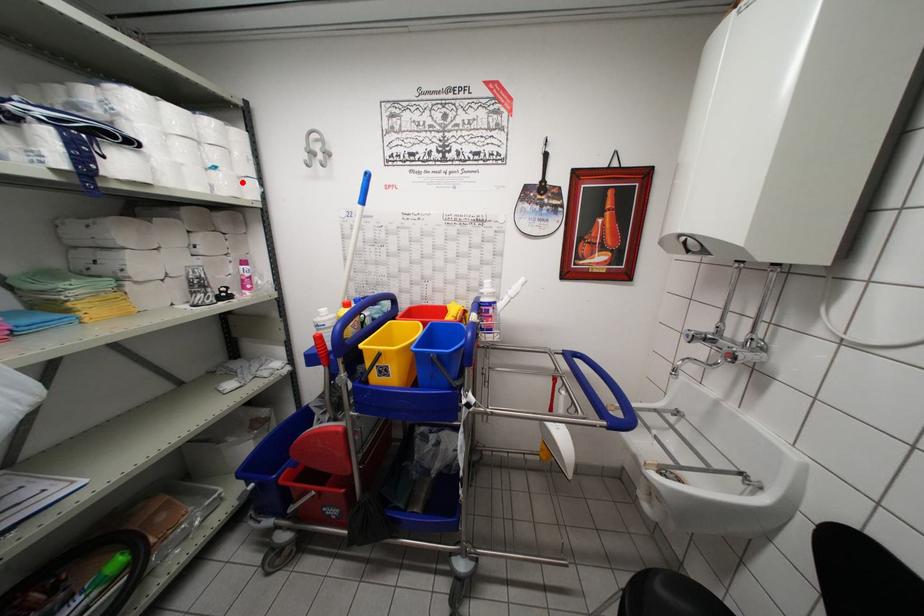
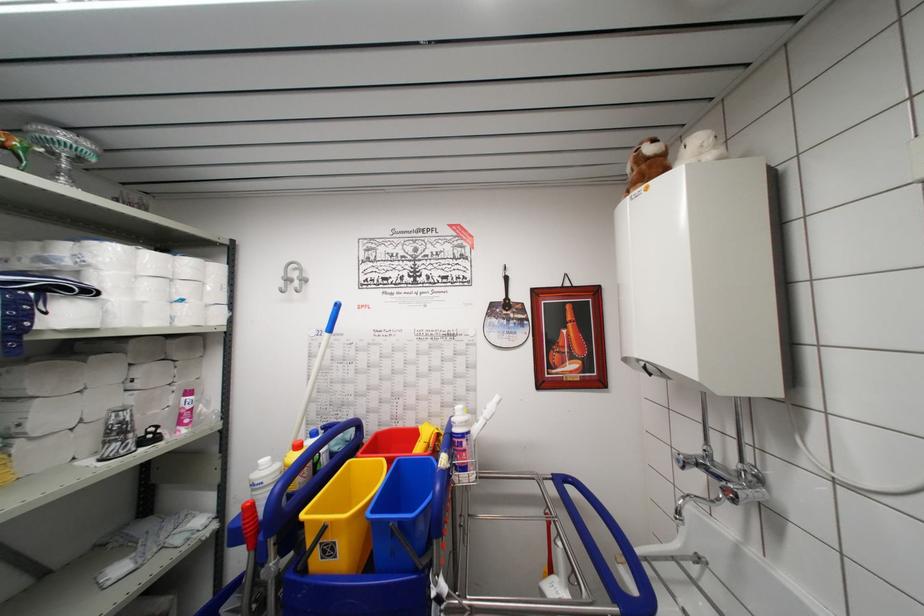
Where in the second image is the point corresponding to the highlighted location from the first image?

(211, 310)